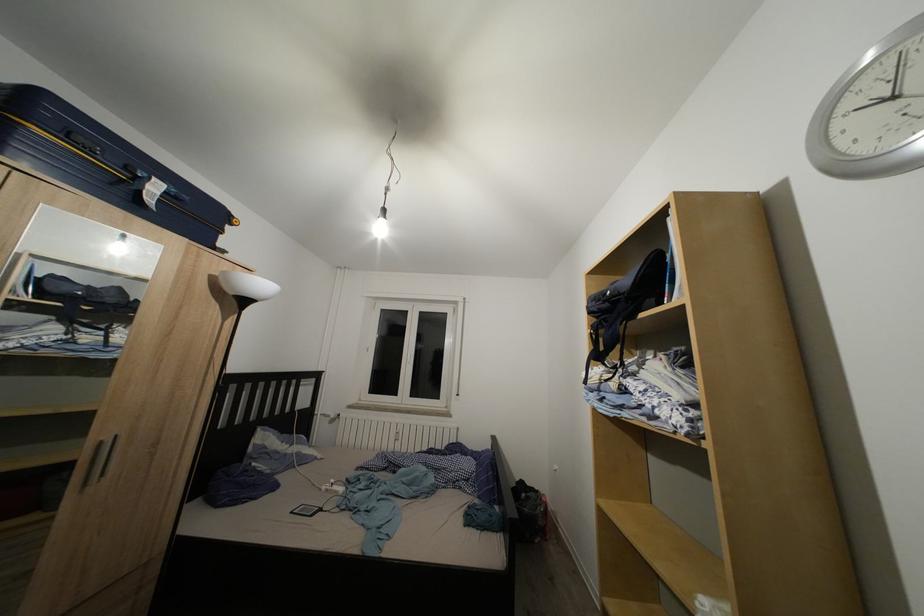
Describe the element at coordinates (100, 461) in the screenshot. This screenshot has height=616, width=924. I see `a silver wardrobe handle` at that location.